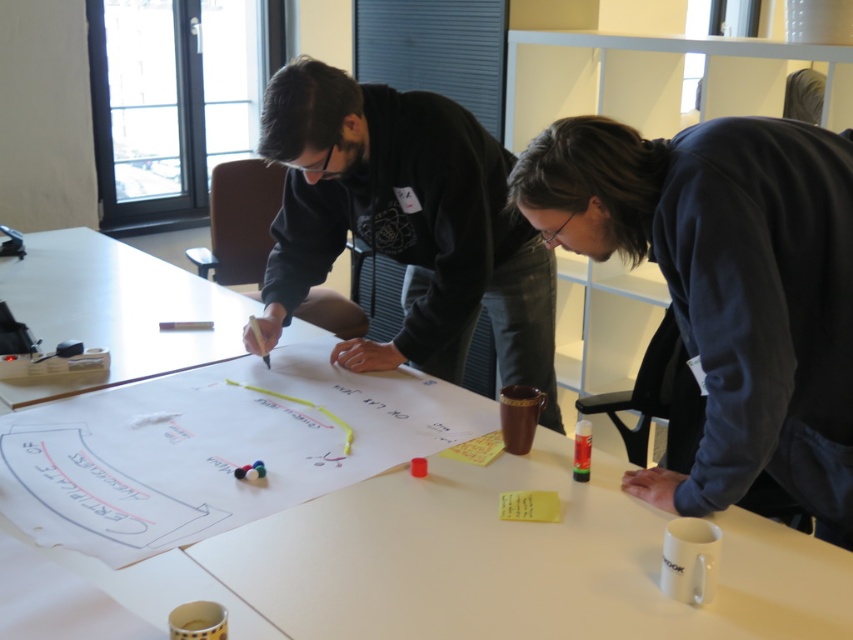
You are a tailor who needs to place a new item between the dark blue sweatshirt at center and the black matte hoodie at center. The item is 20 inches long. Will there be enough space between them to fit the item?

The dark blue sweatshirt at center and black matte hoodie at center are 22.88 inches apart. Since the item is 20 inches long, it can fit between them as the available space is larger than the item.

You are a photographer who needs to set up a camera to capture the white paperboard at center clearly. The camera must be placed exactly 1 meter away from the paperboard. Based on the scene description, can you position the camera at the required distance?

The white paperboard at center and camera are 99.22 centimeters apart. Since 99.22 centimeters is approximately 0.99 meters, which is just slightly less than 1 meter, the camera is already positioned very close to the required distance. However, to meet the exact requirement of 1 meter, you would need to move it back by about 0.78 centimeters.